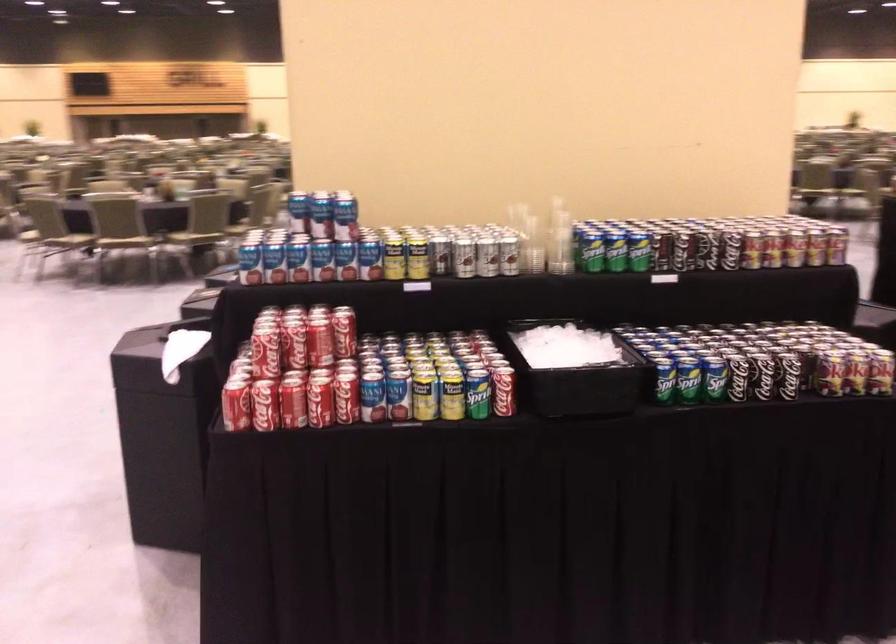
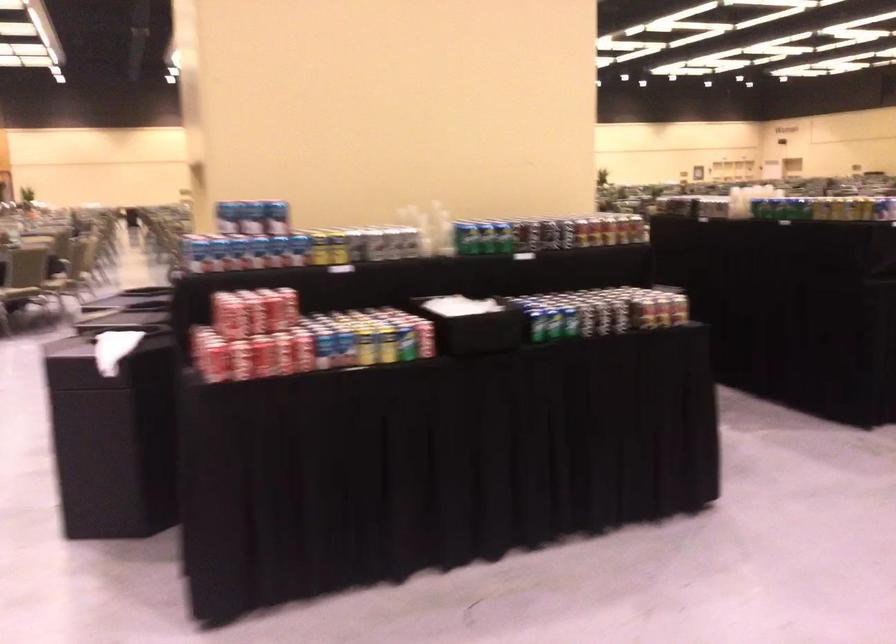
In the second image, find the point that corresponds to (453,397) in the first image.

(386, 345)